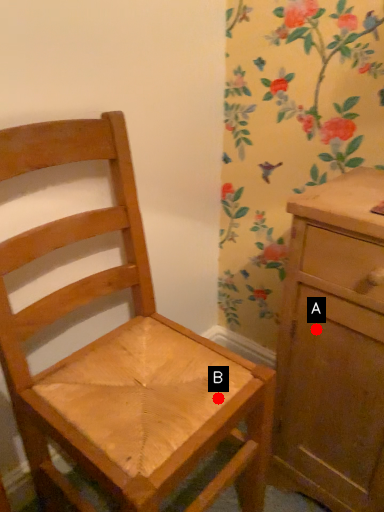
Question: Two points are circled on the image, labeled by A and B beside each circle. Which point appears farthest from the camera in this image?

Choices:
 (A) A is further
 (B) B is further

Answer: (A)